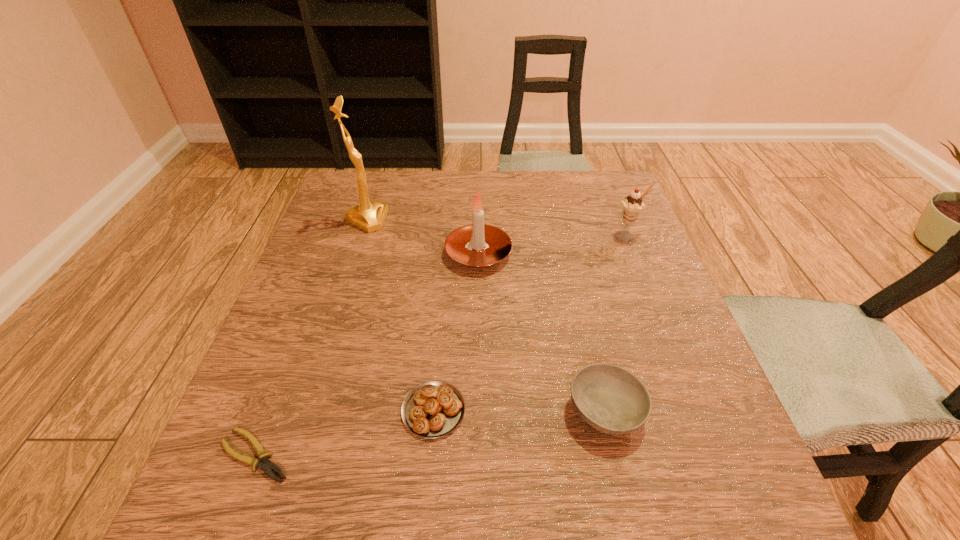
Find the location of `award`. award is located at coordinates (369, 216).

At what (x,y) coordinates should I click in order to perform the action: click on candle. Please return your answer as a coordinate pair (x, y). The image size is (960, 540). Looking at the image, I should click on (478, 245).

Locate an element on the screen. Image resolution: width=960 pixels, height=540 pixels. the rightmost object is located at coordinates (633, 204).

The height and width of the screenshot is (540, 960). In order to click on the fourth tallest object in this screenshot , I will do coord(612,400).

At what (x,y) coordinates should I click in order to perform the action: click on the second object from right to left. Please return your answer as a coordinate pair (x, y). The height and width of the screenshot is (540, 960). Looking at the image, I should click on (612, 400).

Identify the location of the second shortest object. Image resolution: width=960 pixels, height=540 pixels. (433, 409).

The image size is (960, 540). I want to click on pliers, so click(x=267, y=466).

Locate an element on the screen. The height and width of the screenshot is (540, 960). free spot located on the front-facing side of the award is located at coordinates (414, 220).

You are a GUI agent. You are given a task and a screenshot of the screen. Output one action in this format:
    pyautogui.click(x=<x>, y=<y>)
    Task: Click on the vacant area situated on the left of the candle
    
    Given the screenshot: What is the action you would take?
    pyautogui.click(x=407, y=254)

Locate an element on the screen. vacant area situated on the front of the rightmost object is located at coordinates (680, 366).